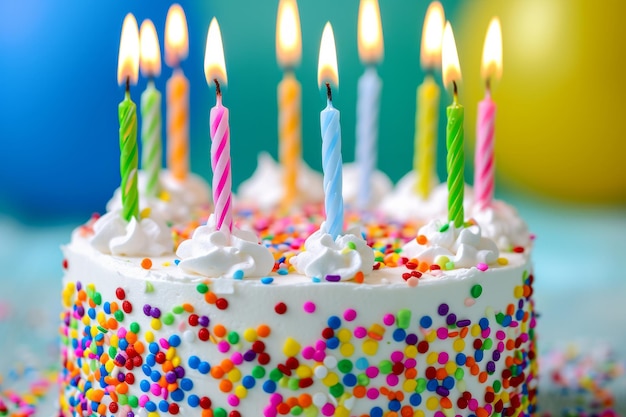
Where is `candle wick`? This screenshot has width=626, height=417. candle wick is located at coordinates (131, 84), (150, 76), (177, 60), (218, 91), (289, 66), (327, 94), (375, 57), (432, 71), (454, 91), (488, 85).